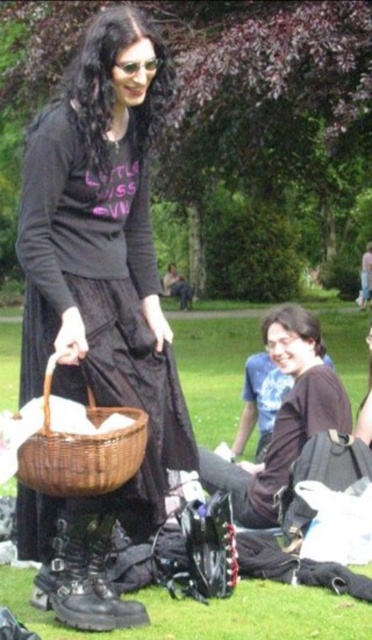
You are a fashion designer observing the scene. You need to place both the brown leather jacket at lower center and the woven brown basket at lower left on a mannequin. Which item should you place first if you want to ensure there is enough space for both?

You should place the brown leather jacket at lower center first because it is wider than the woven brown basket at lower left, ensuring there is enough space for both items.